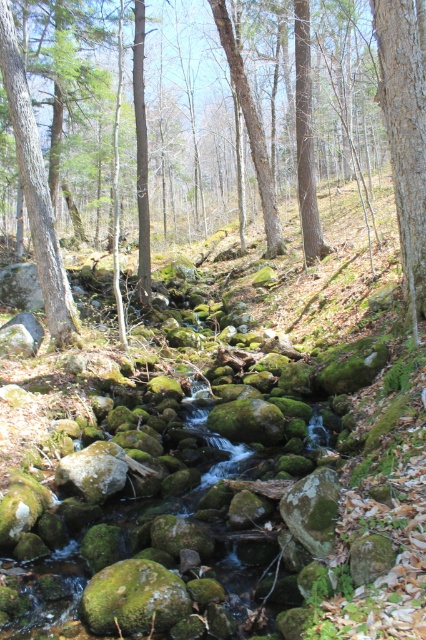
Does smooth bark tree at right have a larger size compared to green textured tree trunk at left?

Incorrect, smooth bark tree at right is not larger than green textured tree trunk at left.

Can you confirm if smooth bark tree at right is thinner than green textured tree trunk at left?

Yes, smooth bark tree at right is thinner than green textured tree trunk at left.

Who is more forward, (373, 26) or (17, 72)?

Point (17, 72) is more forward.

Locate an element on the screen. smooth bark tree at right is located at coordinates (405, 136).

Can you confirm if green mossy rock at center is positioned above smooth bark tree at right?

Indeed, green mossy rock at center is positioned over smooth bark tree at right.

Who is positioned more to the left, green mossy rock at center or smooth bark tree at right?

From the viewer's perspective, green mossy rock at center appears more on the left side.

Locate an element on the screen. This screenshot has width=426, height=640. green mossy rock at center is located at coordinates (405, 132).

Consider the image. Who is more forward, (256, 148) or (11, 70)?

Point (11, 70) is more forward.

Who is positioned more to the right, green mossy rock at center or green textured tree trunk at left?

green mossy rock at center

Is point (414, 108) positioned before point (8, 26)?

Yes, point (414, 108) is closer to viewer.

Find the location of a particular element. The width and height of the screenshot is (426, 640). green mossy rock at center is located at coordinates (405, 132).